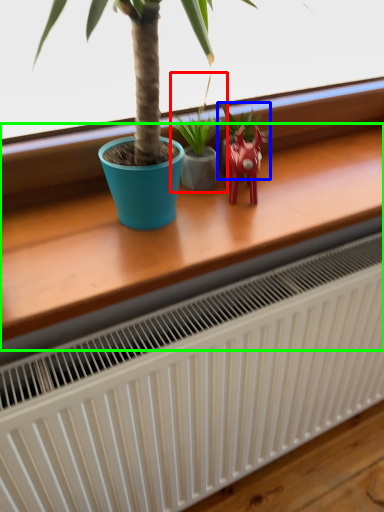
Question: Which object is the closest to the houseplant (highlighted by a red box)? Choose among these: houseplant (highlighted by a blue box) or table (highlighted by a green box).

Choices:
 (A) houseplant
 (B) table

Answer: (A)